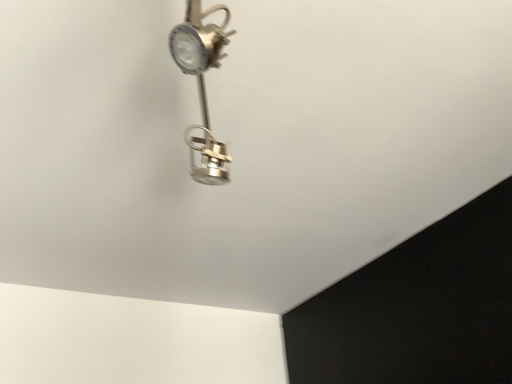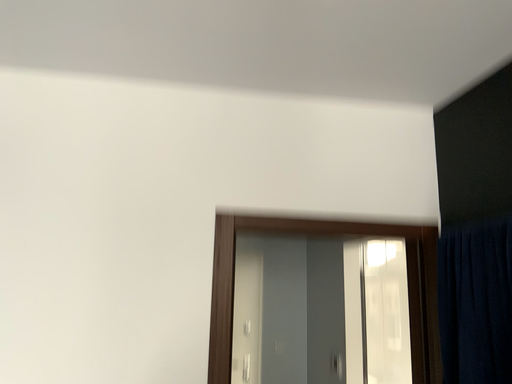
Question: Which way did the camera rotate in the video?

Choices:
 (A) rotated right
 (B) rotated left

Answer: (B)